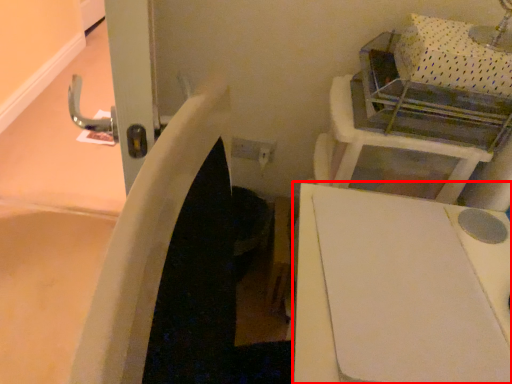
Question: Considering the relative positions of furniture (annotated by the red box) and vanity in the image provided, where is furniture (annotated by the red box) located with respect to the staircase?

Choices:
 (A) left
 (B) right

Answer: (A)